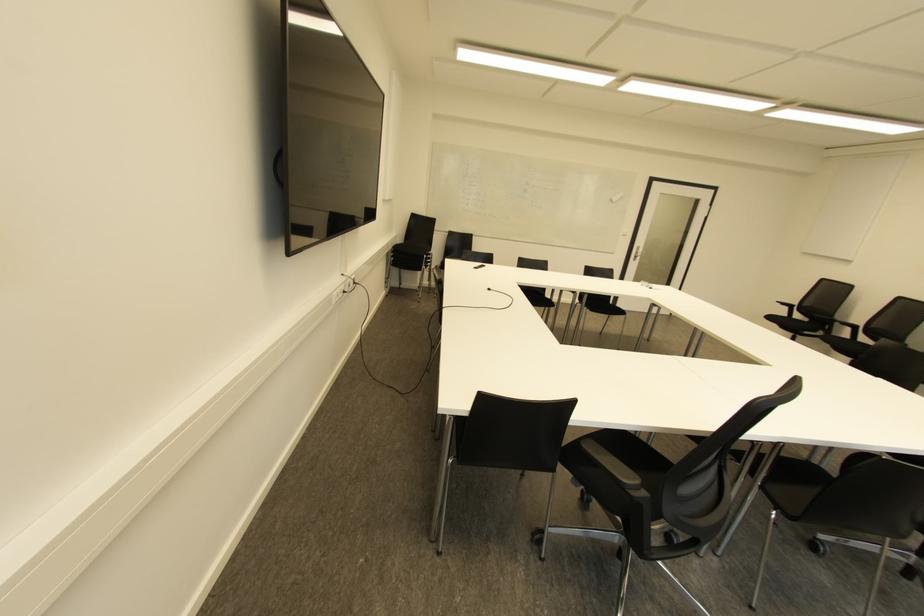
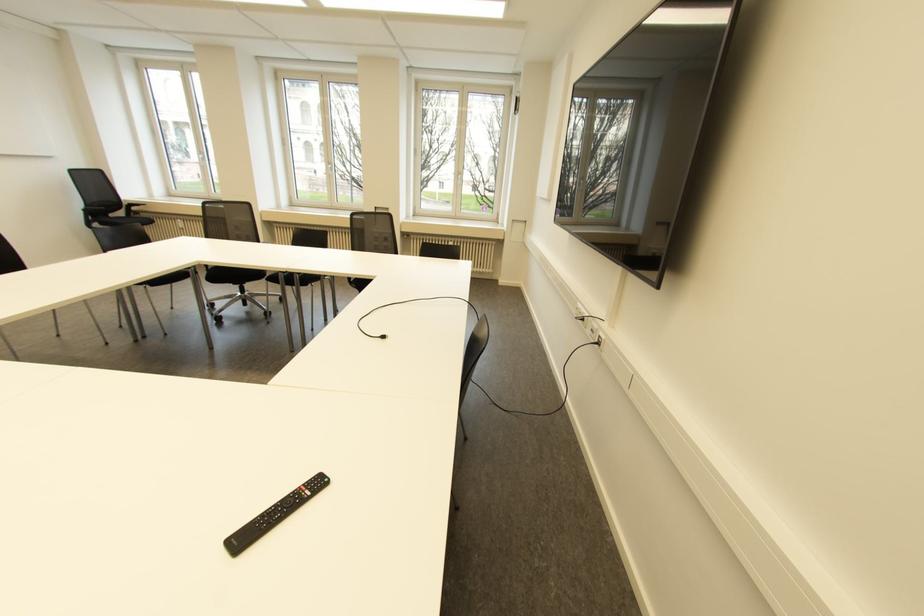
Question: I am providing you with two images of the same scene from different viewpoints. Which of the following objects are not visible in image2?

Choices:
 (A) chair sitting surface
 (B) black remote control
 (C) black chair armrest
 (D) monopoly game box

Answer: (A)